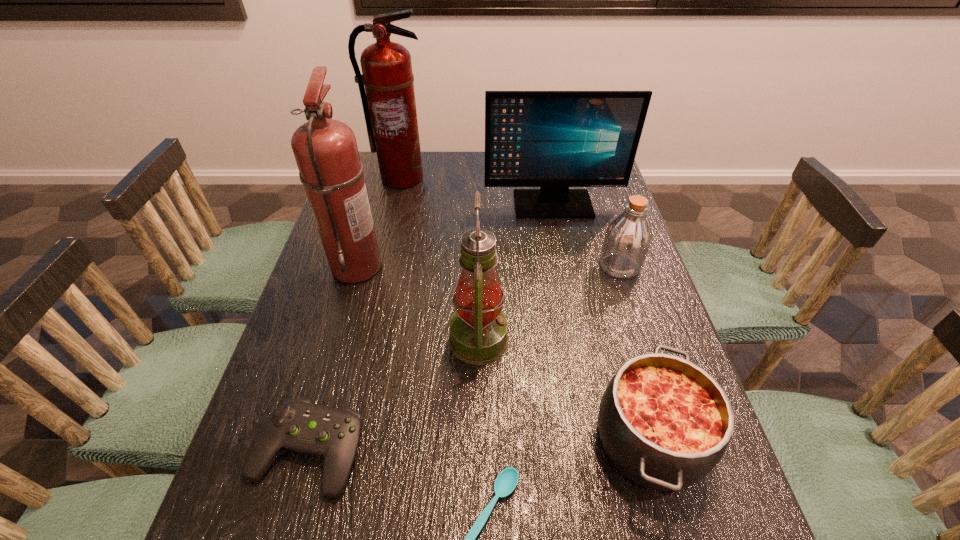
This screenshot has height=540, width=960. Find the location of `free space that satisfies the following two spatial constraints: 1. on the front-facing side of the nearer fire extinguisher; 2. on the right side of the fourth nearest object`. free space that satisfies the following two spatial constraints: 1. on the front-facing side of the nearer fire extinguisher; 2. on the right side of the fourth nearest object is located at coordinates (336, 340).

What are the coordinates of `free space in the image that satisfies the following two spatial constraints: 1. on the nozzle side of the oil lamp; 2. on the right side of the farthest object` in the screenshot? It's located at (364, 340).

Identify the location of free point that satisfies the following two spatial constraints: 1. on the screen side of the seventh nearest object; 2. on the front-facing side of the nearer fire extinguisher. The width and height of the screenshot is (960, 540). (564, 266).

This screenshot has width=960, height=540. Identify the location of free location that satisfies the following two spatial constraints: 1. on the front-facing side of the nearer fire extinguisher; 2. on the back side of the fifth farthest object. (336, 340).

You are a GUI agent. You are given a task and a screenshot of the screen. Output one action in this format:
    pyautogui.click(x=<x>, y=<y>)
    Task: Click on the free spot that satisfies the following two spatial constraints: 1. on the nozzle side of the farthest object; 2. on the left side of the fourth shortest object
    
    Given the screenshot: What is the action you would take?
    pyautogui.click(x=381, y=266)

I want to click on vacant space that satisfies the following two spatial constraints: 1. on the front-facing side of the nearer fire extinguisher; 2. on the back side of the sixth tallest object, so click(x=307, y=440).